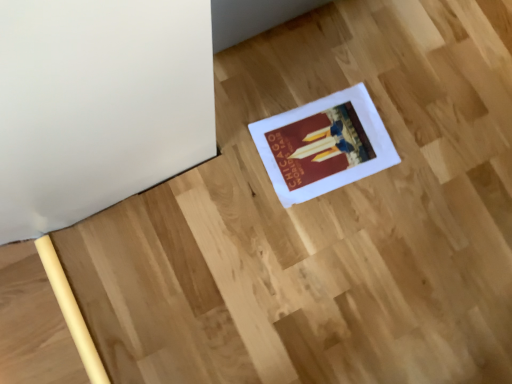
I want to click on white matte picture frame at center, so click(323, 145).

Describe the element at coordinates (323, 145) in the screenshot. The height and width of the screenshot is (384, 512). I see `white matte picture frame at center` at that location.

At what (x,y) coordinates should I click in order to perform the action: click on white matte picture frame at center. Please return your answer as a coordinate pair (x, y). The width and height of the screenshot is (512, 384). Looking at the image, I should click on pos(323,145).